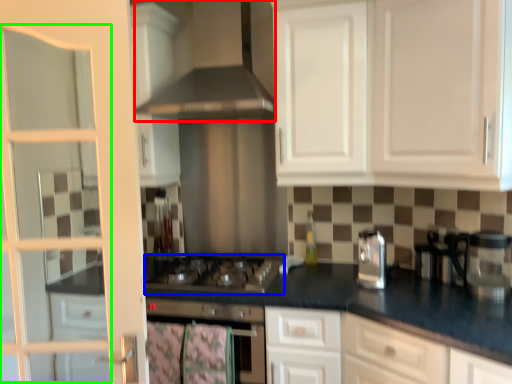
Question: Which object is positioned closest to exhaust hood (highlighted by a red box)? Select from gas stove (highlighted by a blue box) and screen door (highlighted by a green box).

Choices:
 (A) gas stove
 (B) screen door

Answer: (B)